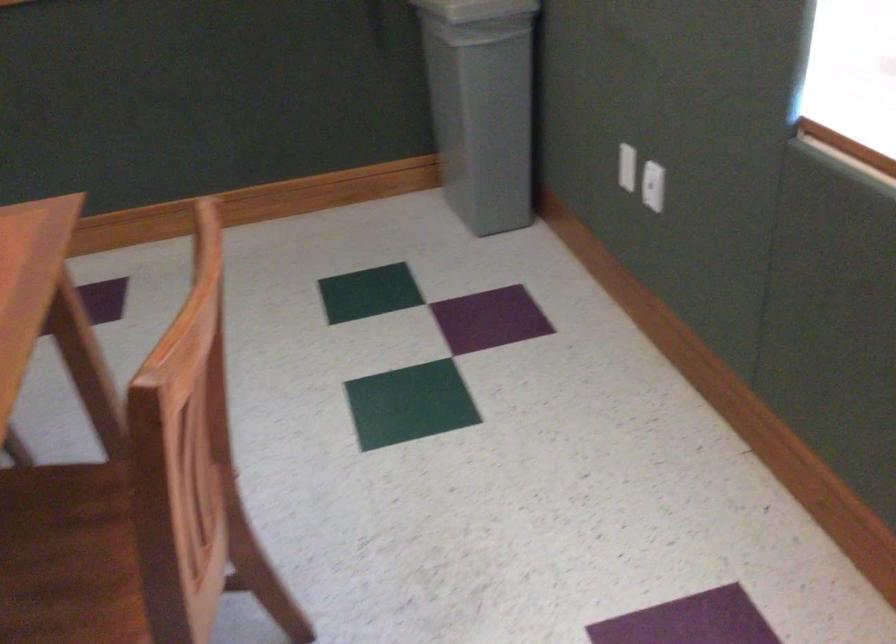
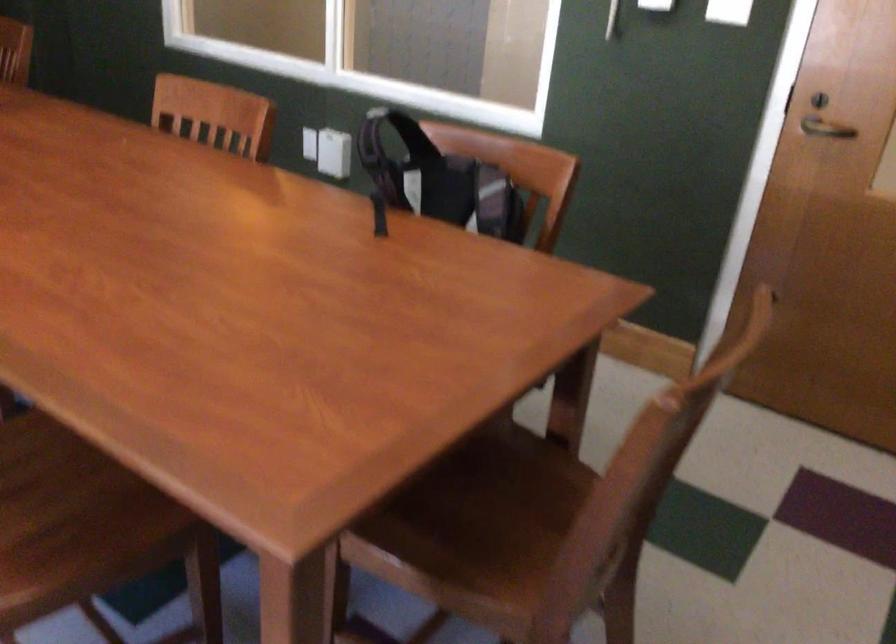
Find the pixel in the second image that matches point 95,534 in the first image.

(52, 498)